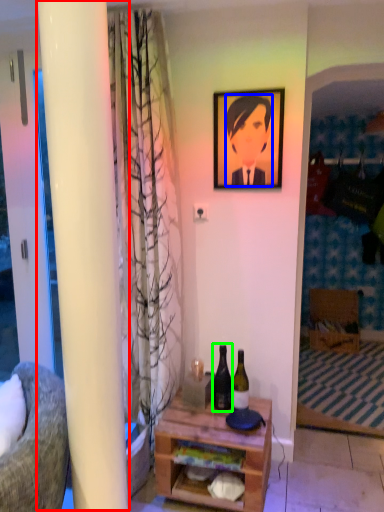
Question: Considering the real-world distances, which object is closest to pillar (highlighted by a red box)? person (highlighted by a blue box) or bottle (highlighted by a green box).

Choices:
 (A) person
 (B) bottle

Answer: (B)